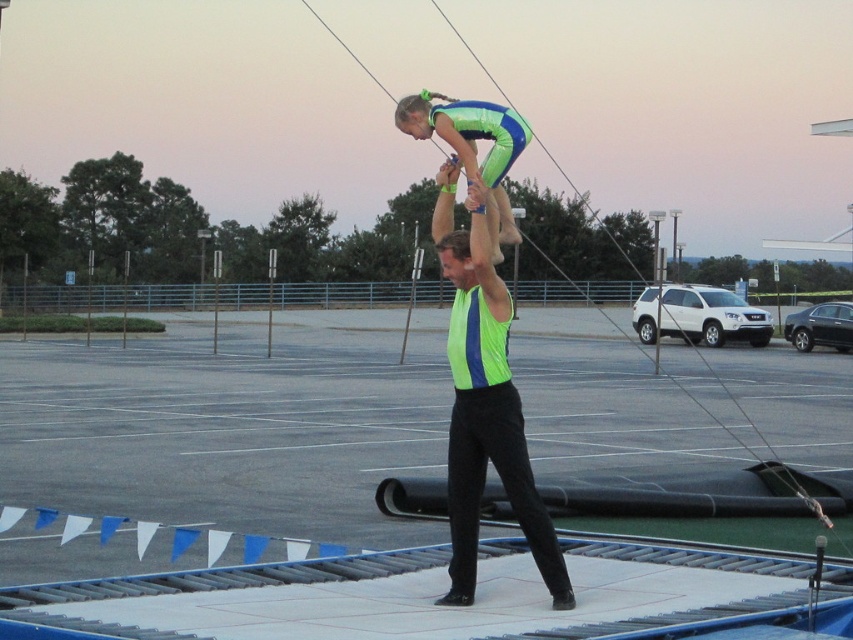
Question: Based on their relative distances, which object is farther from the green fabric head at center?

Choices:
 (A) neon green fabric at center
 (B) green fabric head at upper center
 (C) green matte gymnast at upper center

Answer: (B)

Question: Which of the following is the closest to the observer?

Choices:
 (A) neon green fabric safety vest at center
 (B) green matte gymnast at upper center
 (C) neon green fabric at center

Answer: (C)

Question: Does neon green fabric at center appear on the right side of green fabric head at center?

Choices:
 (A) yes
 (B) no

Answer: (A)

Question: Which point is closer to the camera?

Choices:
 (A) (468, 336)
 (B) (428, 109)
 (C) (471, 160)

Answer: (A)

Question: Can you confirm if neon green fabric safety vest at center is bigger than green fabric head at upper center?

Choices:
 (A) yes
 (B) no

Answer: (B)

Question: Does green matte gymnast at upper center appear over green fabric head at center?

Choices:
 (A) yes
 (B) no

Answer: (A)